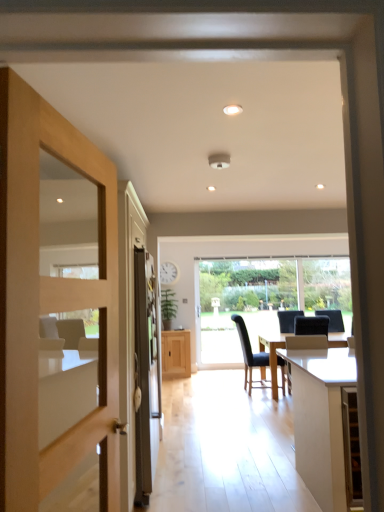
Question: Considering the positions of light wood door at left and light oak cabinet at center in the image, is light wood door at left taller or shorter than light oak cabinet at center?

Choices:
 (A) short
 (B) tall

Answer: (B)

Question: From a real-world perspective, is light wood door at left physically located above or below light oak cabinet at center?

Choices:
 (A) below
 (B) above

Answer: (B)

Question: Which is nearer to the metallic silver screen door at left?

Choices:
 (A) light oak cabinet at center
 (B) light wood door at left
 (C) transparent glass window at center
 (D) dark blue fabric chair at center, which ranks as the 2th chair in right-to-left order
 (E) black leather chair at center, which is counted as the first chair, starting from the right

Answer: (B)

Question: Considering the real-world distances, which object is closest to the transparent glass window at center?

Choices:
 (A) dark blue fabric chair at center, which ranks as the 2th chair in right-to-left order
 (B) white glossy table at lower right
 (C) light oak cabinet at center
 (D) metallic silver screen door at left
 (E) black leather chair at center, which is counted as the first chair, starting from the right

Answer: (A)